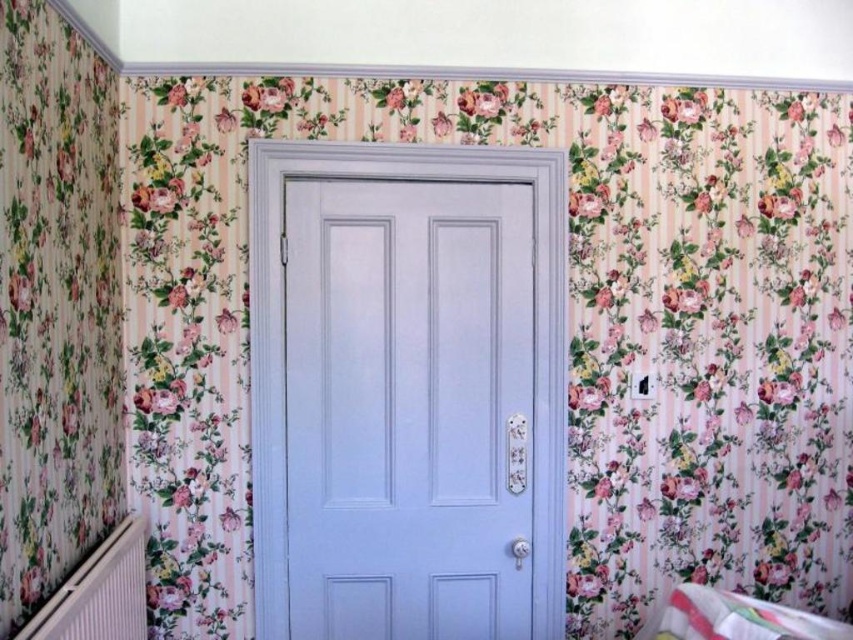
Question: Is matte white door at center thinner than multicolored fabric infant bed at lower right?

Choices:
 (A) yes
 (B) no

Answer: (B)

Question: Which object appears farthest from the camera in this image?

Choices:
 (A) matte white door at center
 (B) multicolored fabric infant bed at lower right

Answer: (A)

Question: Can you confirm if matte white door at center is wider than multicolored fabric infant bed at lower right?

Choices:
 (A) no
 (B) yes

Answer: (B)

Question: Which point is closer to the camera taking this photo?

Choices:
 (A) (511, 545)
 (B) (773, 628)

Answer: (B)

Question: Observing the image, what is the correct spatial positioning of matte white door at center in reference to multicolored fabric infant bed at lower right?

Choices:
 (A) left
 (B) right

Answer: (A)